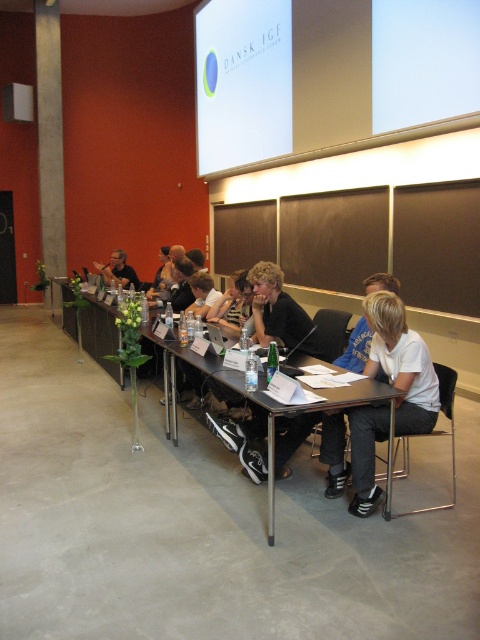
Question: Which object appears closest to the camera in this image?

Choices:
 (A) matte black shirt at center
 (B) white glossy projection screen at upper center

Answer: (B)

Question: Among these objects, which one is farthest from the camera?

Choices:
 (A) black plastic table at center
 (B) white matte projection screen at upper center
 (C) matte black shirt at center

Answer: (C)

Question: Does white glossy projection screen at upper center appear on the left side of matte black shirt at center?

Choices:
 (A) yes
 (B) no

Answer: (B)

Question: Is white matte shirt at center bigger than matte black shirt at center?

Choices:
 (A) no
 (B) yes

Answer: (B)

Question: Is white matte shirt at center to the right of black plastic table at center from the viewer's perspective?

Choices:
 (A) yes
 (B) no

Answer: (A)

Question: Which object is positioned farthest from the white matte shirt at center?

Choices:
 (A) white glossy projection screen at upper center
 (B) white matte projection screen at upper center
 (C) black plastic table at center

Answer: (A)